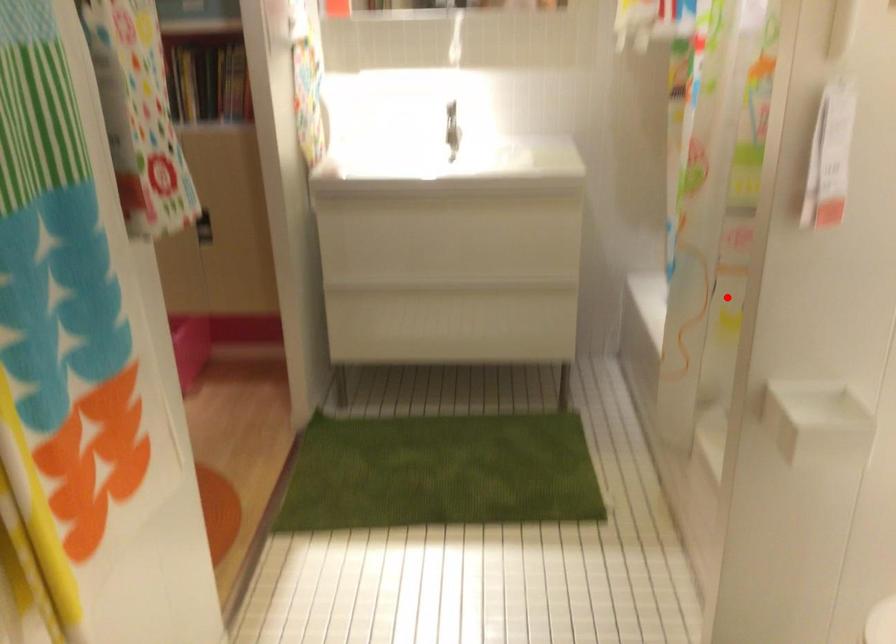
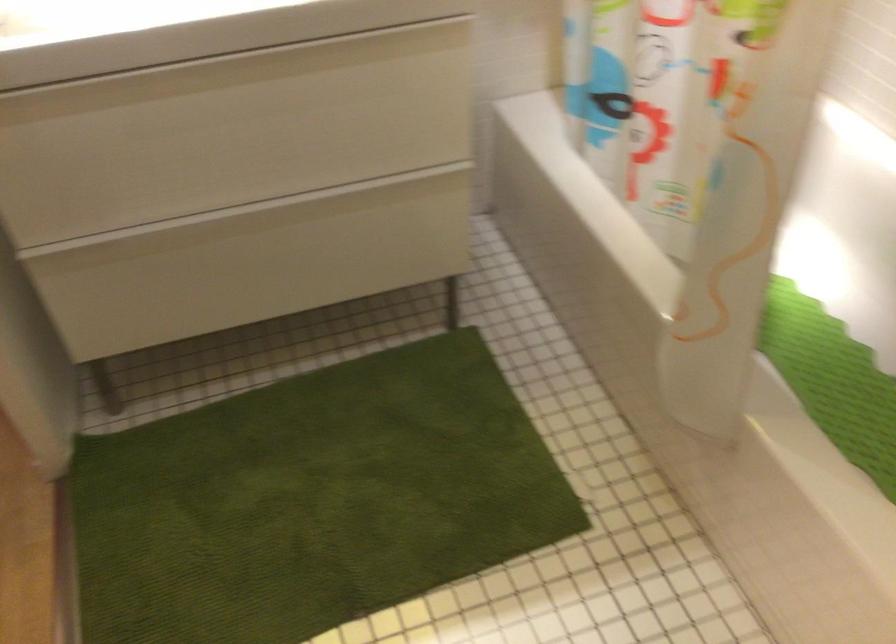
Question: A red point is marked in image1. In image2, is the corresponding 3D point closer to the camera or farther? Reply with the corresponding letter.

Choices:
 (A) The corresponding 3D point is closer.
 (B) The corresponding 3D point is farther.

Answer: (A)